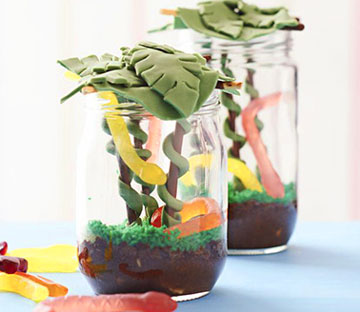
The width and height of the screenshot is (360, 312). In order to click on fake plant stems in this screenshot , I will do `click(122, 171)`, `click(179, 145)`, `click(230, 102)`, `click(250, 83)`.